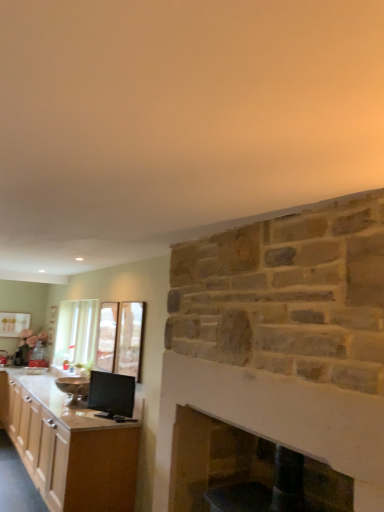
Question: Is clear glass door at center, which is the first glass door from back to front, thinner than clear glass door at upper center, placed as the 2th glass door when sorted from back to front?

Choices:
 (A) yes
 (B) no

Answer: (B)

Question: Is clear glass door at upper center, the 2th glass door viewed from the left, at the back of clear glass door at center, the 2th glass door positioned from the right?

Choices:
 (A) no
 (B) yes

Answer: (A)

Question: Can you confirm if clear glass door at center, the 2th glass door positioned from the right, is taller than clear glass door at upper center, acting as the first glass door starting from the right?

Choices:
 (A) yes
 (B) no

Answer: (B)

Question: Is clear glass door at center, arranged as the 2th glass door when viewed from the front, not within clear glass door at upper center, placed as the 2th glass door when sorted from back to front?

Choices:
 (A) yes
 (B) no

Answer: (A)

Question: From the image's perspective, is clear glass door at center, which is the first glass door from left to right, on top of clear glass door at upper center, which appears as the first glass door when viewed from the front?

Choices:
 (A) yes
 (B) no

Answer: (B)

Question: From the image's perspective, is clear glass door at center, arranged as the 2th glass door when viewed from the front, located above or below metallic silver bowl at left, the first appliance in the back-to-front sequence?

Choices:
 (A) above
 (B) below

Answer: (A)

Question: From a real-world perspective, is clear glass door at center, which is the first glass door from left to right, physically located above or below metallic silver bowl at left, which is counted as the 1th appliance, starting from the left?

Choices:
 (A) below
 (B) above

Answer: (B)

Question: Is point (100, 321) positioned closer to the camera than point (72, 378)?

Choices:
 (A) farther
 (B) closer

Answer: (A)

Question: From their relative heights in the image, would you say clear glass door at center, the 2th glass door positioned from the right, is taller or shorter than metallic silver bowl at left, which is counted as the 1th appliance, starting from the left?

Choices:
 (A) short
 (B) tall

Answer: (B)

Question: Is wooden cabinet at left to the left or to the right of clear glass door at center, which is the first glass door from left to right, in the image?

Choices:
 (A) right
 (B) left

Answer: (B)

Question: Is wooden cabinet at left inside the boundaries of clear glass door at center, which is the first glass door from back to front, or outside?

Choices:
 (A) inside
 (B) outside

Answer: (B)

Question: Is wooden cabinet at left bigger or smaller than clear glass door at center, which is the first glass door from left to right?

Choices:
 (A) big
 (B) small

Answer: (A)

Question: In terms of width, does wooden cabinet at left look wider or thinner when compared to clear glass door at center, arranged as the 2th glass door when viewed from the front?

Choices:
 (A) wide
 (B) thin

Answer: (A)

Question: Considering the relative positions of matte black monitor at lower left, which appears as the second appliance when viewed from the back, and clear glass door at upper center, placed as the 2th glass door when sorted from back to front, in the image provided, is matte black monitor at lower left, which appears as the second appliance when viewed from the back, to the left or to the right of clear glass door at upper center, placed as the 2th glass door when sorted from back to front,?

Choices:
 (A) left
 (B) right

Answer: (A)

Question: From the image's perspective, is matte black monitor at lower left, positioned as the 2th appliance in left-to-right order, positioned above or below clear glass door at upper center, the 2th glass door viewed from the left?

Choices:
 (A) above
 (B) below

Answer: (B)